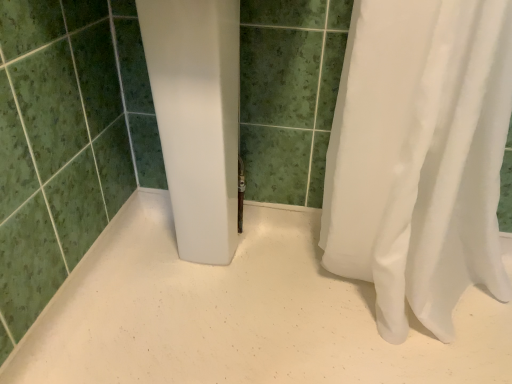
Question: Do you think white matte shower curtain at right is within green matte tile at center, or outside of it?

Choices:
 (A) outside
 (B) inside

Answer: (A)

Question: Is point (322, 329) positioned closer to the camera than point (37, 253)?

Choices:
 (A) farther
 (B) closer

Answer: (A)

Question: In the image, is white matte shower curtain at right on the left side or the right side of green matte tile at center?

Choices:
 (A) left
 (B) right

Answer: (B)

Question: From the image's perspective, is green matte tile at center above or below white matte shower curtain at right?

Choices:
 (A) below
 (B) above

Answer: (B)

Question: Looking at the image, does green matte tile at center seem bigger or smaller compared to white matte shower curtain at right?

Choices:
 (A) small
 (B) big

Answer: (B)

Question: In the image, is green matte tile at center positioned in front of or behind white matte shower curtain at right?

Choices:
 (A) behind
 (B) front

Answer: (B)

Question: Choose the correct answer: Is green matte tile at center inside white matte shower curtain at right or outside it?

Choices:
 (A) inside
 (B) outside

Answer: (B)